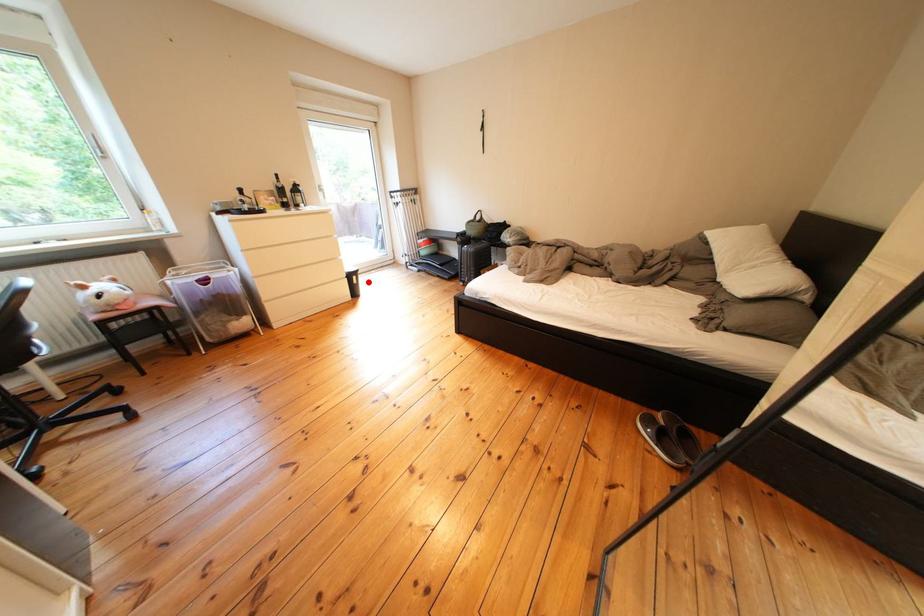
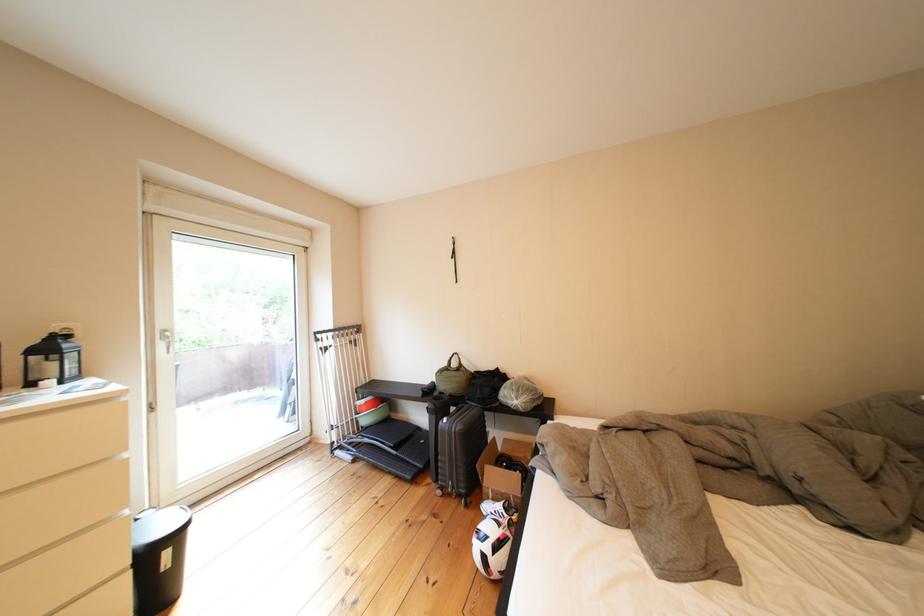
Question: A red point is marked in image1. In image2, is the corresponding 3D point closer to the camera or farther? Reply with the corresponding letter.

Choices:
 (A) The corresponding 3D point is closer.
 (B) The corresponding 3D point is farther.

Answer: (B)